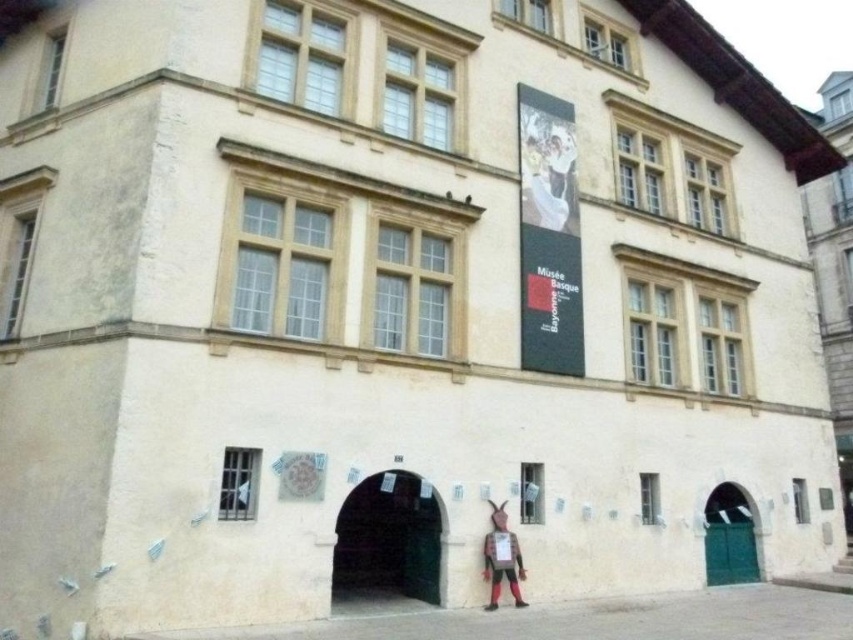
You are standing at the camera position looking at the Mus??e Basque et des Beaux Arts building. There is a point at coordinates point (525, 129). If you want to throw a ball to hit that point, will you be able to reach it with a throw of 15 meters?

The distance between point (525, 129) and the camera is 15.58 meters. Since your throw can only reach 15 meters, you won? reach it.

You are an art enthusiast visiting the Mus?e Basque. You notice a matte white dress at upper center and a matte brown figure at lower center in the image. Which object is positioned higher in the scene?

The matte white dress at upper center is positioned higher than the matte brown figure at lower center.

You are an art student visiting the Mus?e Basque. You notice two items in the image. One is a matte white dress at upper center and the other is a matte brown figure at lower center. Which item is wider?

The matte white dress at upper center is wider than the matte brown figure at lower center.